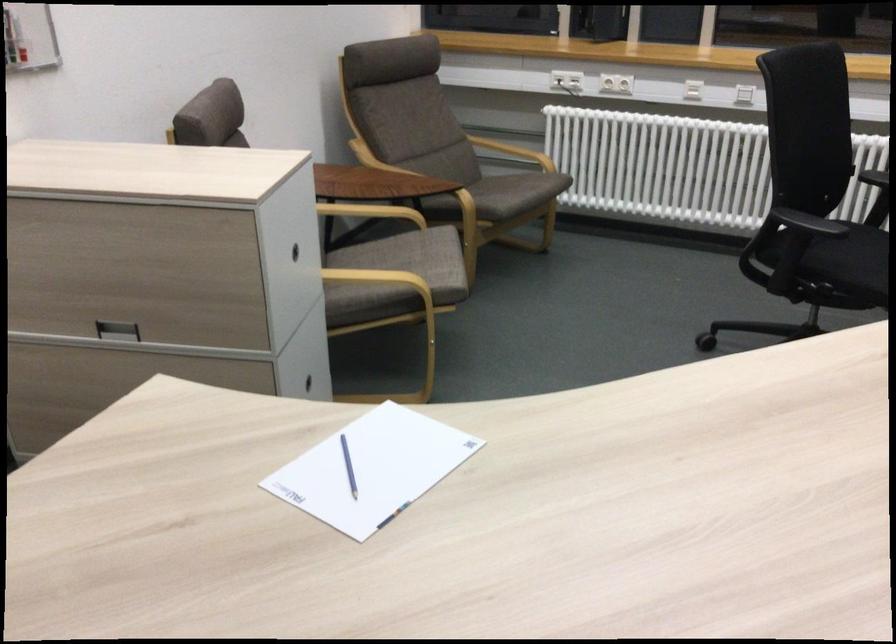
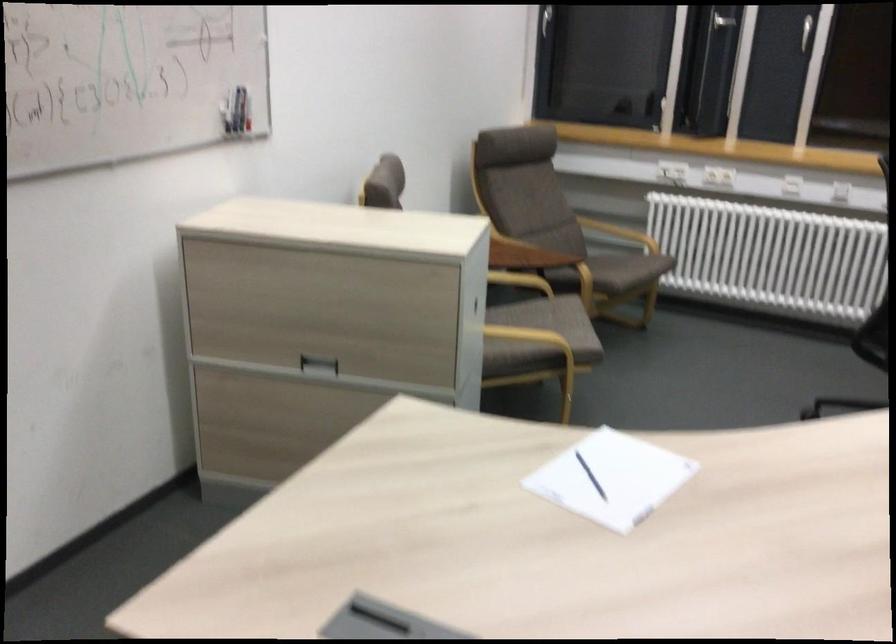
Locate, in the second image, the point that corresponds to [506,154] in the first image.

(619, 232)